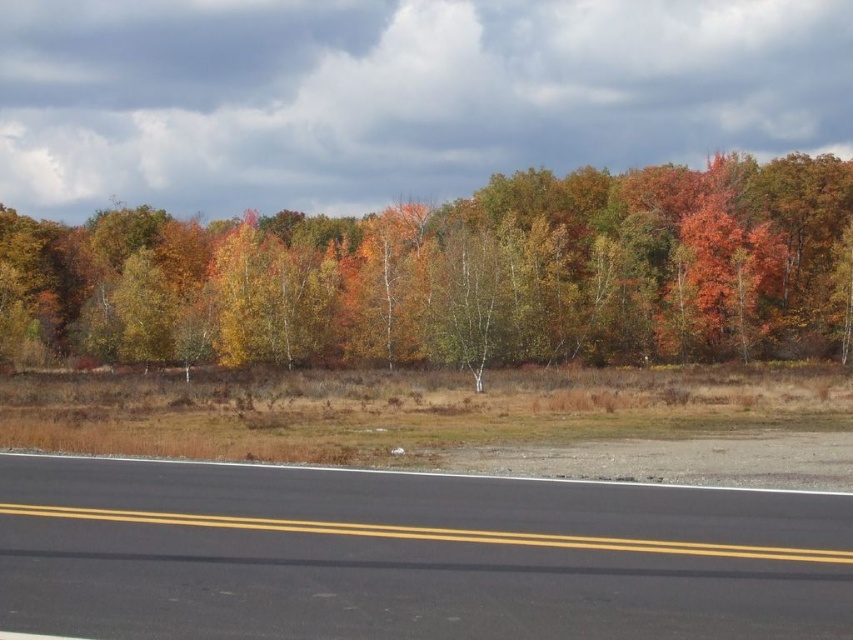
The width and height of the screenshot is (853, 640). What do you see at coordinates (468, 273) in the screenshot? I see `autumn leaves at upper center` at bounding box center [468, 273].

Who is more distant from viewer, (490,180) or (772,524)?

Point (490,180)

Which is in front, point (593, 212) or point (601, 538)?

Point (601, 538) is in front.

This screenshot has height=640, width=853. In order to click on autumn leaves at upper center in this screenshot , I will do `click(468, 273)`.